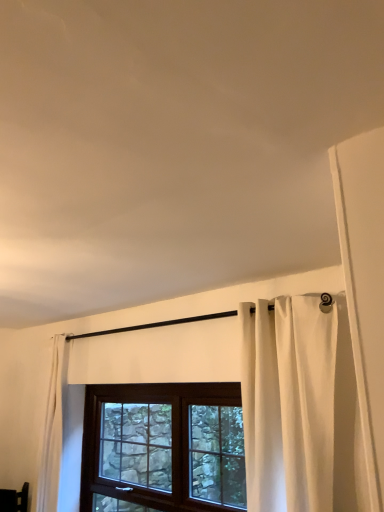
Question: From the image's perspective, is white fabric curtain at center under brown wooden window at center?

Choices:
 (A) no
 (B) yes

Answer: (A)

Question: Is white fabric curtain at center looking in the opposite direction of brown wooden window at center?

Choices:
 (A) no
 (B) yes

Answer: (A)

Question: From a real-world perspective, is white fabric curtain at center positioned under brown wooden window at center based on gravity?

Choices:
 (A) no
 (B) yes

Answer: (A)

Question: Is white fabric curtain at center to the right of brown wooden window at center from the viewer's perspective?

Choices:
 (A) yes
 (B) no

Answer: (A)

Question: Considering the relative positions of white fabric curtain at center and brown wooden window at center in the image provided, is white fabric curtain at center to the left of brown wooden window at center from the viewer's perspective?

Choices:
 (A) no
 (B) yes

Answer: (A)

Question: Does white fabric curtain at center turn towards brown wooden window at center?

Choices:
 (A) yes
 (B) no

Answer: (B)

Question: Is brown wooden window at center outside of white fabric curtain at center?

Choices:
 (A) no
 (B) yes

Answer: (B)

Question: Is the position of brown wooden window at center more distant than that of white fabric curtain at center?

Choices:
 (A) yes
 (B) no

Answer: (A)

Question: Are brown wooden window at center and white fabric curtain at center beside each other?

Choices:
 (A) yes
 (B) no

Answer: (B)

Question: Can you confirm if brown wooden window at center is taller than white fabric curtain at center?

Choices:
 (A) no
 (B) yes

Answer: (A)

Question: Does brown wooden window at center have a lesser width compared to white fabric curtain at center?

Choices:
 (A) no
 (B) yes

Answer: (B)

Question: Is white fabric curtain at center at the back of brown wooden window at center?

Choices:
 (A) no
 (B) yes

Answer: (A)

Question: Is brown wooden window at center bigger or smaller than white fabric curtain at center?

Choices:
 (A) small
 (B) big

Answer: (B)